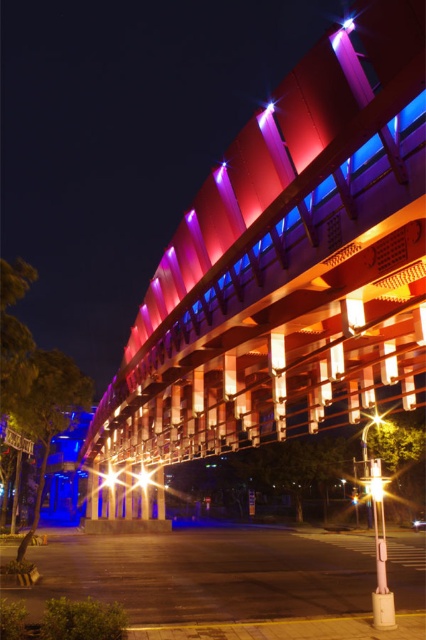
You are a pedestrian standing on the sidewalk and see both the bright metallic streetlight at center and the bright metallic light at center. Which one appears closer to you?

The bright metallic streetlight at center appears closer to you because it is further to the viewer than the bright metallic light at center.

You are standing at the pedestrian crossing and want to locate the bright metallic streetlight at center. According to the coordinates provided, in which direction should you look relative to your position?

The bright metallic streetlight at center is located at coordinates point (143, 477). Since the coordinate system is not specified, it is recommended to check the coordinate system details to determine the exact direction.